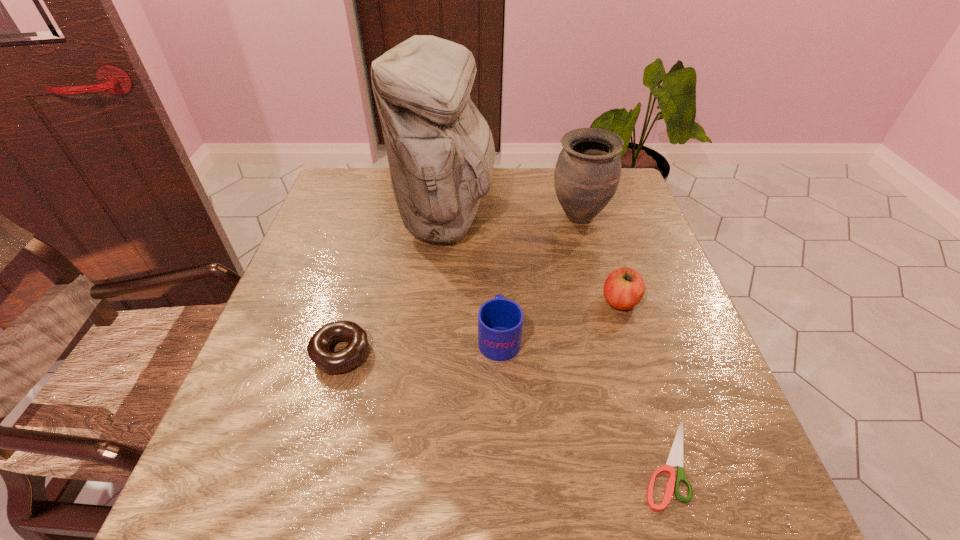
Locate an element on the screen. vacant area located on the side with the handle of the mug is located at coordinates (495, 245).

Where is `free space located 0.250m on the side with the handle of the mug`? free space located 0.250m on the side with the handle of the mug is located at coordinates (495, 242).

This screenshot has width=960, height=540. I want to click on vacant space situated on the back of the apple, so click(x=600, y=239).

Locate an element on the screen. vacant area situated 0.070m on the back of the doughnut is located at coordinates (353, 306).

Where is `vacant area located 0.130m on the left of the nearest object`? This screenshot has width=960, height=540. vacant area located 0.130m on the left of the nearest object is located at coordinates (560, 463).

At what (x,y) coordinates should I click in order to perform the action: click on backpack located in the far edge section of the desktop. Please return your answer as a coordinate pair (x, y). Looking at the image, I should click on (440, 149).

Where is `urn located at the far edge`? The width and height of the screenshot is (960, 540). urn located at the far edge is located at coordinates (587, 173).

Find the location of a particular element. Image resolution: width=960 pixels, height=540 pixels. object present at the near edge is located at coordinates (675, 458).

This screenshot has height=540, width=960. Find the location of `object that is at the left edge`. object that is at the left edge is located at coordinates (319, 345).

You are a GUI agent. You are given a task and a screenshot of the screen. Output one action in this format:
    pyautogui.click(x=<x>, y=<y>)
    Task: Click on the urn situated at the right edge
    The image size is (960, 540).
    Given the screenshot: What is the action you would take?
    pyautogui.click(x=587, y=173)